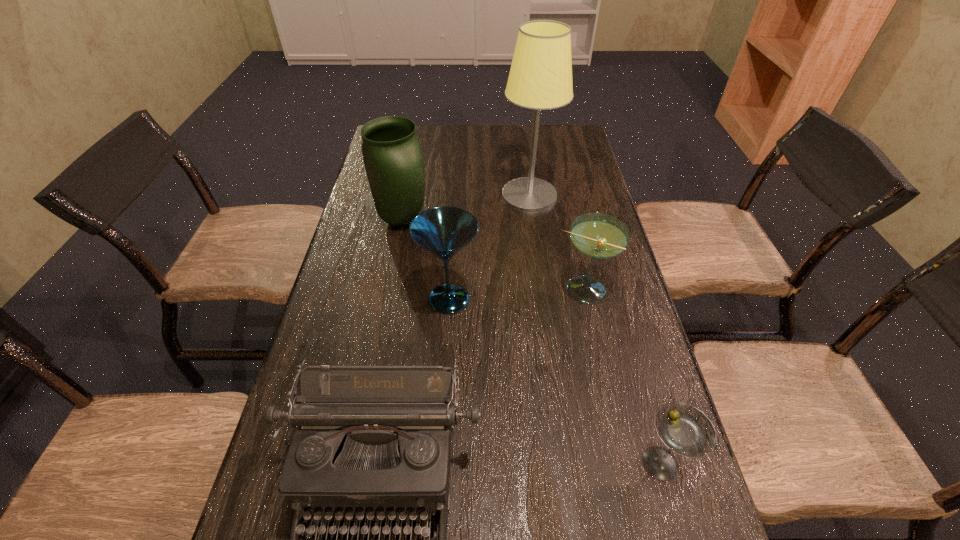
Locate an element on the screen. The image size is (960, 540). the tallest object is located at coordinates (540, 78).

Find the location of a particular element. Image resolution: width=960 pixels, height=540 pixels. vase is located at coordinates (393, 160).

At what (x,y) coordinates should I click in order to perform the action: click on the leftmost martini. Please return your answer as a coordinate pair (x, y). The width and height of the screenshot is (960, 540). Looking at the image, I should click on (444, 231).

This screenshot has width=960, height=540. I want to click on the nearest martini, so click(686, 430).

The width and height of the screenshot is (960, 540). What are the coordinates of `the shortest object` in the screenshot? It's located at (686, 430).

Where is `free spot located on the front of the tallest object`? This screenshot has height=540, width=960. free spot located on the front of the tallest object is located at coordinates (538, 256).

You are a GUI agent. You are given a task and a screenshot of the screen. Output one action in this format:
    pyautogui.click(x=<x>, y=<y>)
    Task: Click on the vacant space located on the front of the second tallest object
    
    Given the screenshot: What is the action you would take?
    pyautogui.click(x=379, y=339)

Where is `free space located 0.110m on the front of the leftmost martini`? free space located 0.110m on the front of the leftmost martini is located at coordinates (445, 361).

Where is `blank space located on the back of the shortest object`? Image resolution: width=960 pixels, height=540 pixels. blank space located on the back of the shortest object is located at coordinates (612, 290).

Locate an element on the screen. object located in the left edge section of the desktop is located at coordinates (393, 160).